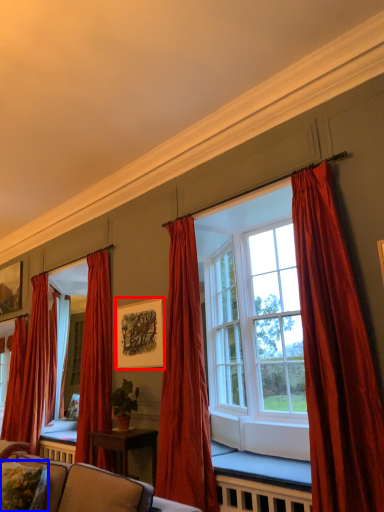
Question: Which of the following is the closest to the observer, picture frame (highlighted by a red box) or pillow (highlighted by a blue box)?

Choices:
 (A) picture frame
 (B) pillow

Answer: (B)